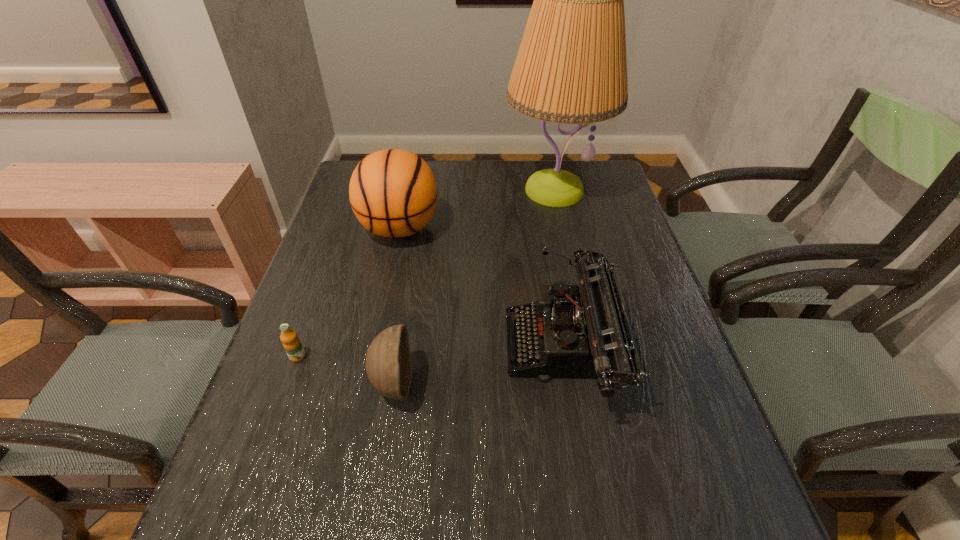
You are a GUI agent. You are given a task and a screenshot of the screen. Output one action in this format:
    pyautogui.click(x=<x>, y=<y>)
    Task: Click on the vacant area situated on the keyboard of the typewriter
    The width and height of the screenshot is (960, 540).
    Given the screenshot: What is the action you would take?
    pyautogui.click(x=404, y=348)

The image size is (960, 540). I want to click on blank area located 0.090m on the back of the bowl, so click(x=403, y=322).

Find the location of a particular element. The width and height of the screenshot is (960, 540). vacant space located 0.230m on the label of the leftmost object is located at coordinates (255, 474).

Identify the location of object that is at the far edge. This screenshot has width=960, height=540. (571, 68).

What are the coordinates of `basketball located in the left edge section of the desktop` in the screenshot? It's located at (393, 193).

Image resolution: width=960 pixels, height=540 pixels. Identify the location of orange juice that is at the left edge. (291, 342).

This screenshot has height=540, width=960. In order to click on lamp situated at the right edge in this screenshot , I will do `click(571, 68)`.

I want to click on typewriter positioned at the right edge, so click(586, 334).

At what (x,y) coordinates should I click in order to perform the action: click on object that is at the far right corner. Please return your answer as a coordinate pair (x, y). This screenshot has width=960, height=540. Looking at the image, I should click on (571, 68).

Where is `free region at the far edge of the desktop`? free region at the far edge of the desktop is located at coordinates (554, 161).